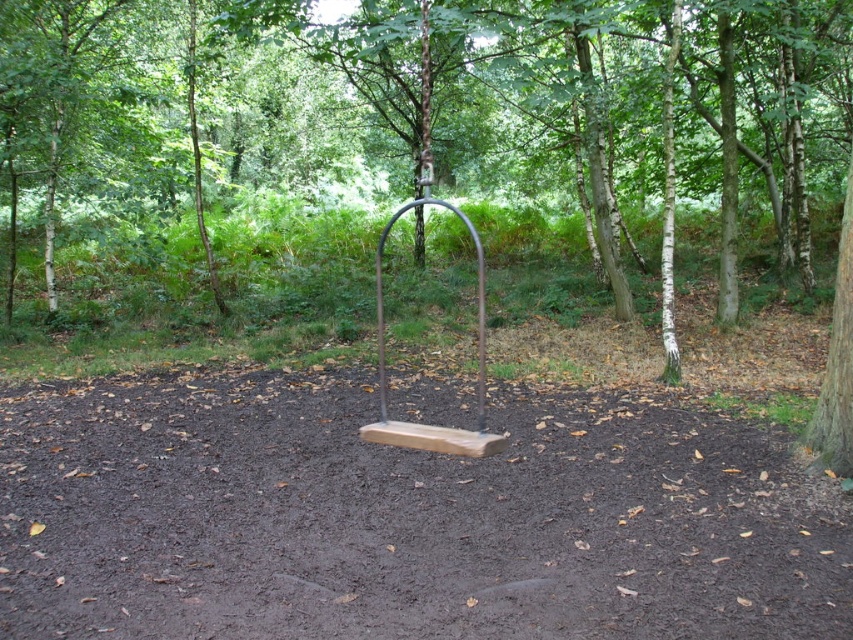
You are a park ranger checking the swing area. The brown wood tree at center and the brown wooden swing at center are both in the central area. Which one has a greater width?

The brown wood tree at center has a greater width than the brown wooden swing at center, as stated in the description.

You are standing at the origin point in the image. Where is the brown wood tree at center located?

The brown wood tree at center is located at point 0.259 in the x coordinate and 0.485 in the y coordinate.